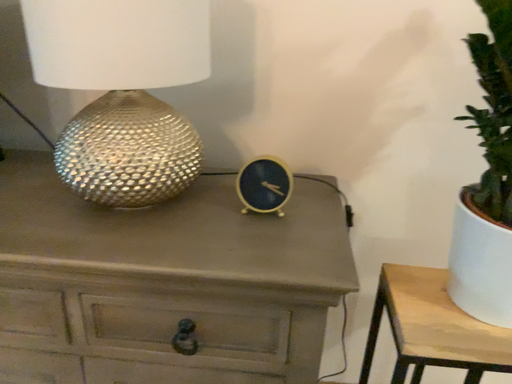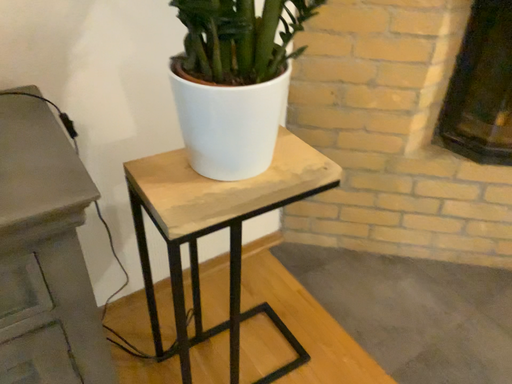
Question: How did the camera likely rotate when shooting the video?

Choices:
 (A) rotated right
 (B) rotated left

Answer: (A)